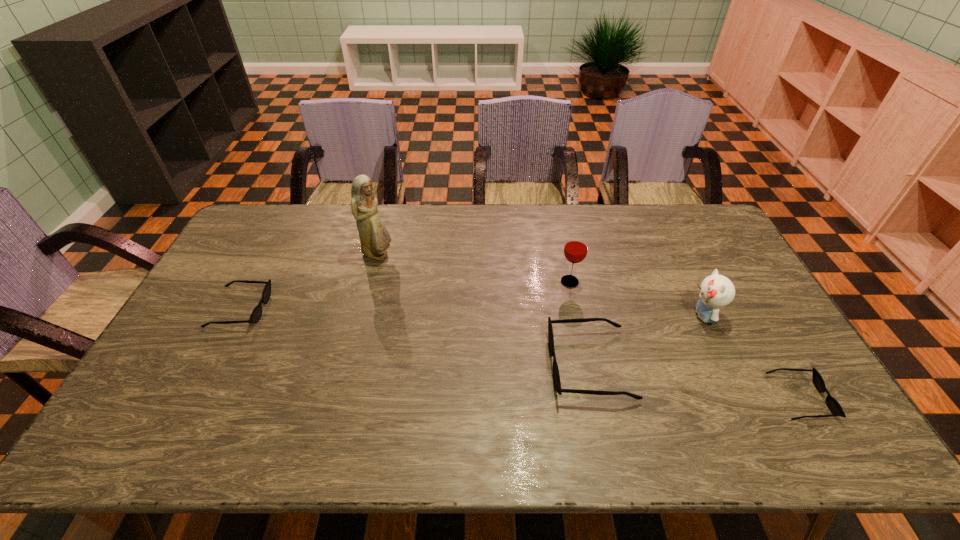
To make them evenly spaced by inserting another sunglasses among them, please locate a free space for this new sunglasses. Please provide its 2D coordinates. Your answer should be formatted as a tuple, i.e. [(x, y)], where the tuple contains the x and y coordinates of a point satisfying the conditions above.

[(405, 335)]